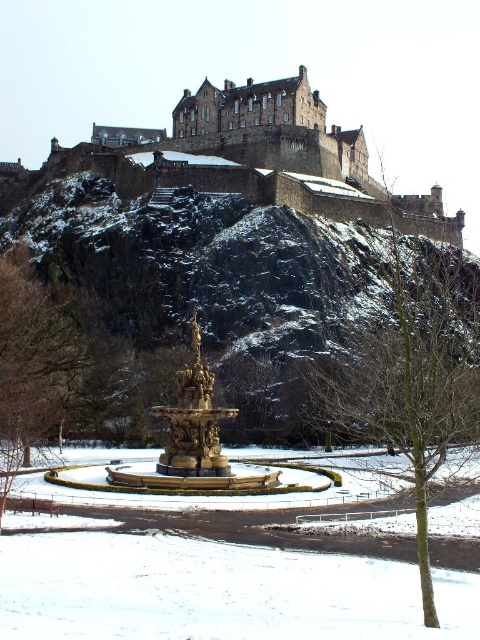
Question: Does bare wood tree at center lie behind gold polished fountain at center?

Choices:
 (A) no
 (B) yes

Answer: (A)

Question: Is the position of brown textured tree at left less distant than that of gold polished fountain at center?

Choices:
 (A) no
 (B) yes

Answer: (B)

Question: Which is farther from the snowy rock hill at upper center?

Choices:
 (A) brown textured tree at left
 (B) white powdery snow at lower center
 (C) bare wood tree at center

Answer: (B)

Question: Which is farther from the brown textured tree at left?

Choices:
 (A) snowy rock hill at upper center
 (B) white powdery snow at lower center
 (C) gold polished fountain at center
 (D) bare wood tree at center

Answer: (D)

Question: Does bare wood tree at center come in front of brown textured tree at left?

Choices:
 (A) no
 (B) yes

Answer: (B)

Question: Which point is farther to the camera?

Choices:
 (A) gold polished fountain at center
 (B) snowy rock hill at upper center
 (C) brown textured tree at left
 (D) bare wood tree at center

Answer: (B)